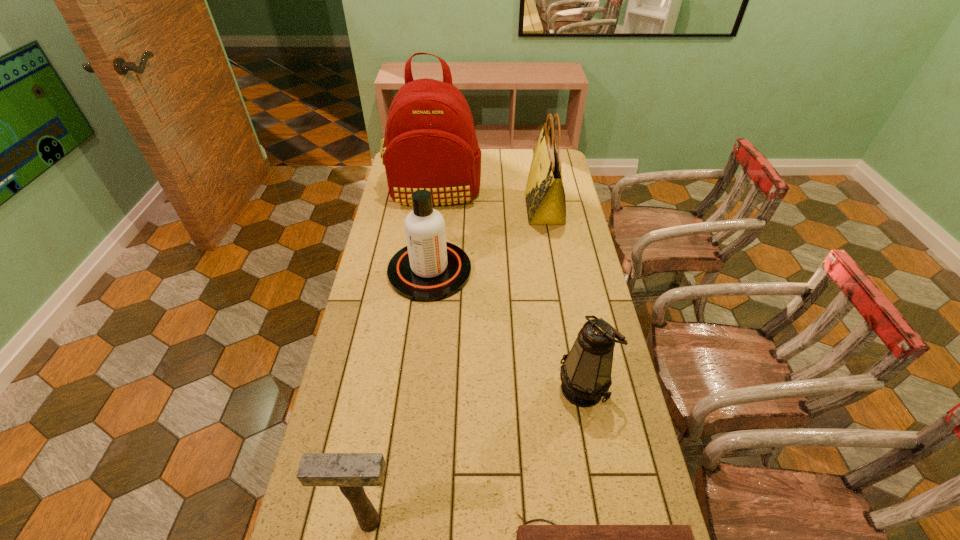
This screenshot has height=540, width=960. What are the coordinates of `free space located on the right of the mallet` in the screenshot? It's located at (570, 521).

Identify the location of free spot located on the left of the oil lamp. The height and width of the screenshot is (540, 960). (466, 388).

At what (x,y) coordinates should I click in order to perform the action: click on backpack that is at the left edge. Please return your answer as a coordinate pair (x, y). Looking at the image, I should click on (430, 143).

Where is `cleansing agent situated at the left edge`? This screenshot has height=540, width=960. cleansing agent situated at the left edge is located at coordinates (428, 269).

In order to click on mallet at the left edge in this screenshot , I will do 350,471.

The height and width of the screenshot is (540, 960). What are the coordinates of `tote bag that is at the right edge` in the screenshot? It's located at (545, 198).

The height and width of the screenshot is (540, 960). Find the location of `oil lamp at the right edge`. oil lamp at the right edge is located at coordinates (585, 373).

I want to click on free space at the far edge, so (498, 173).

I want to click on vacant space at the left edge of the desktop, so click(x=353, y=337).

Find the location of a particular element. vacant space at the right edge is located at coordinates (598, 502).